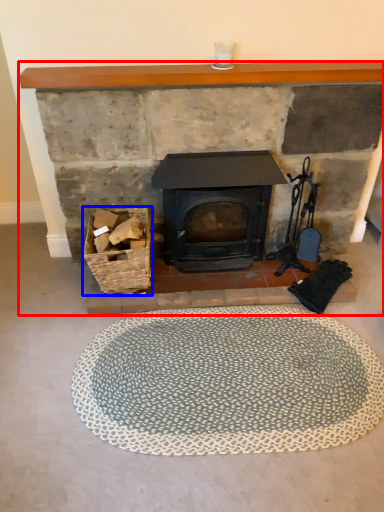
Question: Which of the following is the farthest to the observer, fireplace (highlighted by a red box) or basket (highlighted by a blue box)?

Choices:
 (A) fireplace
 (B) basket

Answer: (B)